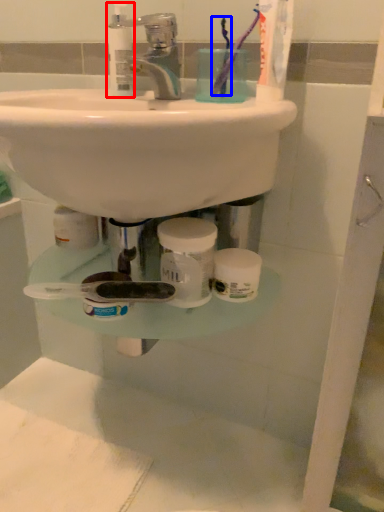
Question: Which object appears closest to the camera in this image, mouthwash (highlighted by a red box) or toothbrush (highlighted by a blue box)?

Choices:
 (A) mouthwash
 (B) toothbrush

Answer: (B)